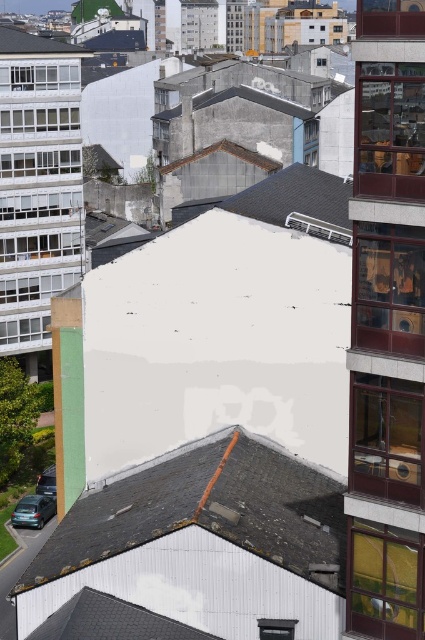
Question: Is gray slate roof at lower left to the left of shiny black car at lower left from the viewer's perspective?

Choices:
 (A) yes
 (B) no

Answer: (B)

Question: Which point is closer to the camera?

Choices:
 (A) (170, 627)
 (B) (8, 49)

Answer: (A)

Question: Among these objects, which one is farthest from the camera?

Choices:
 (A) metallic silver car at lower left
 (B) gray slate roof at lower left
 (C) gray slate roof at lower center
 (D) shiny black car at lower left

Answer: (D)

Question: Which object is the farthest from the shiny black car at lower left?

Choices:
 (A) gray slate roof at lower center
 (B) gray slate roof at lower left
 (C) metallic silver car at lower left

Answer: (B)

Question: Does white shingles at upper left have a greater width compared to metallic silver car at lower left?

Choices:
 (A) yes
 (B) no

Answer: (A)

Question: Observing the image, what is the correct spatial positioning of gray slate roof at lower left in reference to metallic silver car at lower left?

Choices:
 (A) below
 (B) above

Answer: (B)